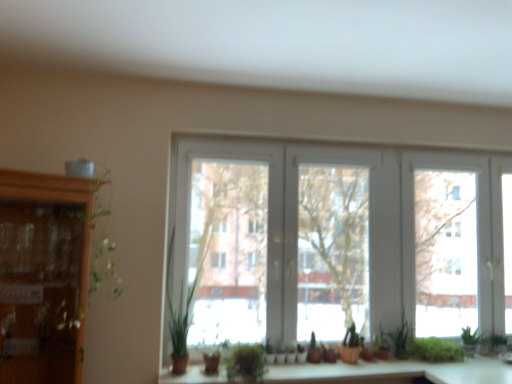
Question: Does green matte plant at center have a lesser height compared to green matte plant at lower right, acting as the fifth plant starting from the left?

Choices:
 (A) yes
 (B) no

Answer: (A)

Question: Can you confirm if green matte plant at center is positioned to the left of green matte plant at lower right, marked as the second plant in a right-to-left arrangement?

Choices:
 (A) no
 (B) yes

Answer: (B)

Question: Is green matte plant at center further to camera compared to green matte plant at lower right, marked as the second plant in a right-to-left arrangement?

Choices:
 (A) no
 (B) yes

Answer: (A)

Question: Is green matte plant at center closer to the viewer compared to green matte plant at lower right, marked as the second plant in a right-to-left arrangement?

Choices:
 (A) yes
 (B) no

Answer: (A)

Question: From the image's perspective, is green matte plant at center below green matte plant at lower right, marked as the second plant in a right-to-left arrangement?

Choices:
 (A) no
 (B) yes

Answer: (B)

Question: Is green matte plant at center positioned beyond the bounds of green matte plant at lower right, marked as the second plant in a right-to-left arrangement?

Choices:
 (A) no
 (B) yes

Answer: (B)

Question: Is green leafy plant at lower right, which appears as the sixth plant when viewed from the left, in contact with green matte plant at center, positioned as the third plant in left-to-right order?

Choices:
 (A) no
 (B) yes

Answer: (A)

Question: Is green leafy plant at lower right, arranged as the 1th plant when viewed from the right, at the right side of green matte plant at center, which appears as the 4th plant when viewed from the right?

Choices:
 (A) yes
 (B) no

Answer: (A)

Question: Does green leafy plant at lower right, arranged as the 1th plant when viewed from the right, have a greater height compared to green matte plant at center, which appears as the 4th plant when viewed from the right?

Choices:
 (A) yes
 (B) no

Answer: (A)

Question: Is green leafy plant at lower right, arranged as the 1th plant when viewed from the right, positioned far away from green matte plant at center, which appears as the 4th plant when viewed from the right?

Choices:
 (A) no
 (B) yes

Answer: (A)

Question: From a real-world perspective, is green leafy plant at lower right, which appears as the sixth plant when viewed from the left, positioned under green matte plant at center, which appears as the 4th plant when viewed from the right, based on gravity?

Choices:
 (A) yes
 (B) no

Answer: (B)

Question: Does green leafy plant at lower right, which appears as the sixth plant when viewed from the left, turn towards green matte plant at center, positioned as the third plant in left-to-right order?

Choices:
 (A) no
 (B) yes

Answer: (A)

Question: Is matte wood counter top at center surrounding green leafy plant at center, which ranks as the sixth plant in right-to-left order?

Choices:
 (A) no
 (B) yes

Answer: (A)